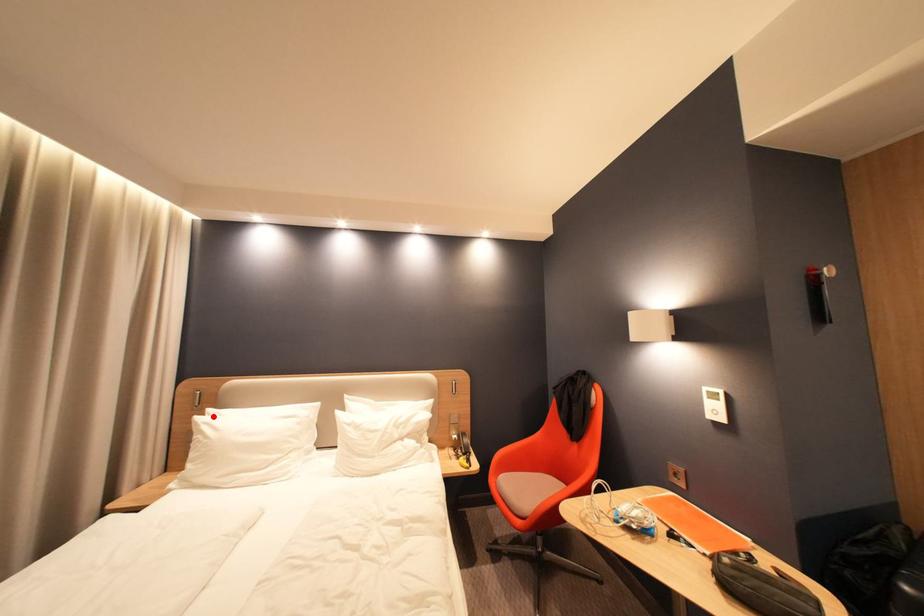
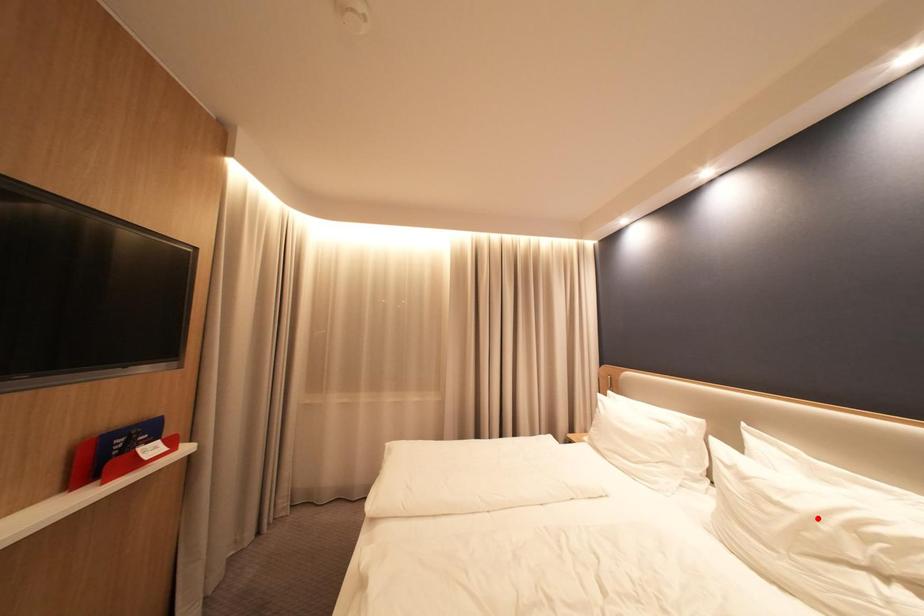
Consider the image. I am providing you with two images of the same scene from different viewpoints. A red point is marked on the first image and another point is marked on the second image. Are the points marked in image1 and image2 representing the same 3D position?

No